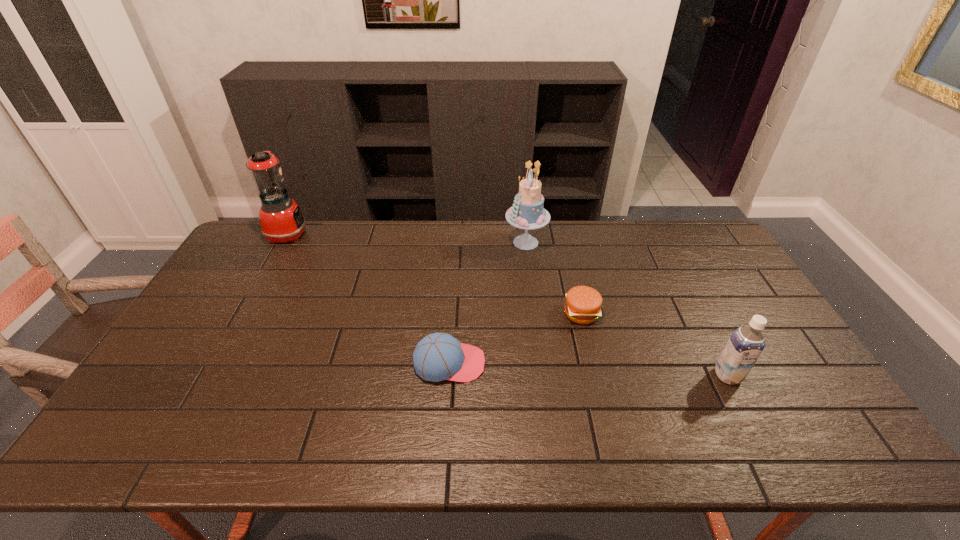
Locate an element on the screen. the leftmost object is located at coordinates (281, 219).

You are a GUI agent. You are given a task and a screenshot of the screen. Output one action in this format:
    pyautogui.click(x=<x>, y=<y>)
    Task: Click on the third object from left to right
    
    Given the screenshot: What is the action you would take?
    pyautogui.click(x=527, y=212)

Where is `soya milk`? This screenshot has height=540, width=960. soya milk is located at coordinates (745, 345).

The width and height of the screenshot is (960, 540). Identify the location of the third tallest object. (745, 345).

At what (x,y) coordinates should I click in order to perform the action: click on the fourth tallest object. Please return your answer as a coordinate pair (x, y). This screenshot has width=960, height=540. Looking at the image, I should click on (439, 356).

Identify the location of baseball cap. The height and width of the screenshot is (540, 960). (439, 356).

In order to click on hamburger in this screenshot , I will do `click(583, 304)`.

At what (x,y) coordinates should I click in order to perform the action: click on the fourth object from left to right. Please return your answer as a coordinate pair (x, y). Looking at the image, I should click on (583, 304).

I want to click on free space located on the controls of the leftmost object, so click(x=324, y=234).

Where is `free spot located 0.180m with a ladder on the side of the cake`? This screenshot has width=960, height=540. free spot located 0.180m with a ladder on the side of the cake is located at coordinates (454, 242).